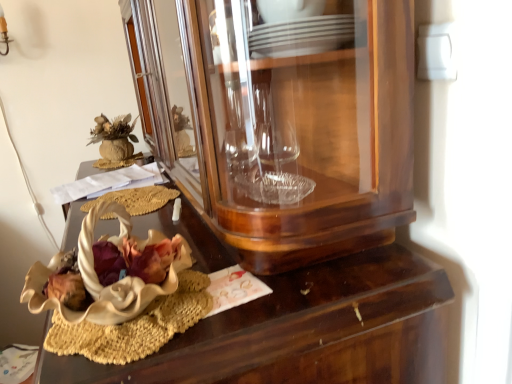
Question: Is the depth of transparent glass cabinet at center greater than that of white matte flower at center?

Choices:
 (A) no
 (B) yes

Answer: (A)

Question: From a real-world perspective, is transparent glass cabinet at center positioned under white matte flower at center based on gravity?

Choices:
 (A) yes
 (B) no

Answer: (B)

Question: Considering the relative sizes of transparent glass cabinet at center and white matte flower at center in the image provided, is transparent glass cabinet at center wider than white matte flower at center?

Choices:
 (A) no
 (B) yes

Answer: (B)

Question: Is transparent glass cabinet at center thinner than white matte flower at center?

Choices:
 (A) yes
 (B) no

Answer: (B)

Question: From the image's perspective, is transparent glass cabinet at center below white matte flower at center?

Choices:
 (A) yes
 (B) no

Answer: (B)

Question: Is transparent glass cabinet at center to the left of white matte flower at center from the viewer's perspective?

Choices:
 (A) yes
 (B) no

Answer: (B)

Question: From the image's perspective, is white matte flower at center below wooden desk at center?

Choices:
 (A) no
 (B) yes

Answer: (A)

Question: Considering the relative positions of white matte flower at center and wooden desk at center in the image provided, is white matte flower at center to the left of wooden desk at center from the viewer's perspective?

Choices:
 (A) yes
 (B) no

Answer: (A)

Question: Is white matte flower at center taller than wooden desk at center?

Choices:
 (A) no
 (B) yes

Answer: (A)

Question: Does white matte flower at center have a lesser width compared to wooden desk at center?

Choices:
 (A) no
 (B) yes

Answer: (B)

Question: Considering the relative sizes of white matte flower at center and wooden desk at center in the image provided, is white matte flower at center shorter than wooden desk at center?

Choices:
 (A) no
 (B) yes

Answer: (B)

Question: From a real-world perspective, does white matte flower at center stand above wooden desk at center?

Choices:
 (A) yes
 (B) no

Answer: (A)

Question: From a real-world perspective, is wooden desk at center physically below white matte flower at center?

Choices:
 (A) yes
 (B) no

Answer: (A)